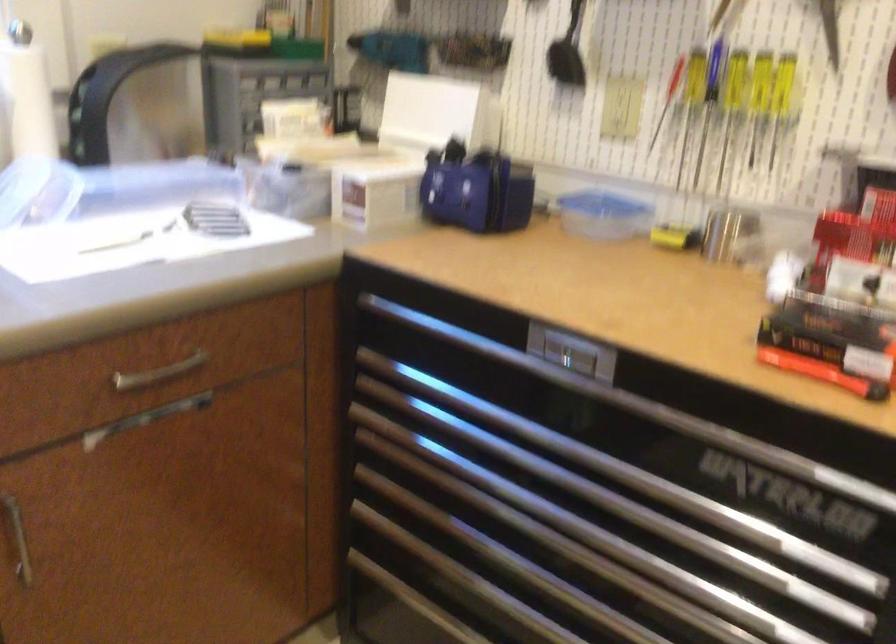
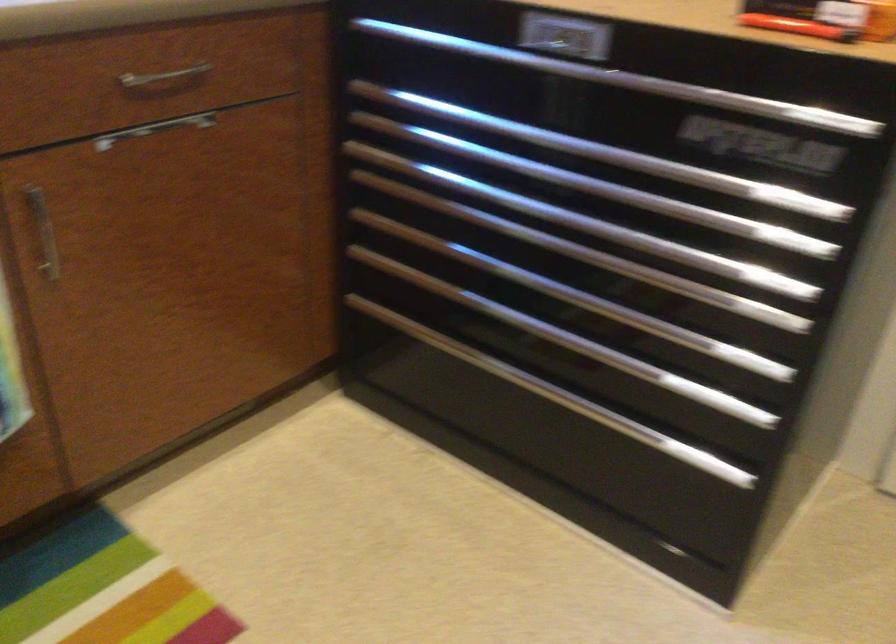
In the second image, find the point that corresponds to (823,370) in the first image.

(797, 26)